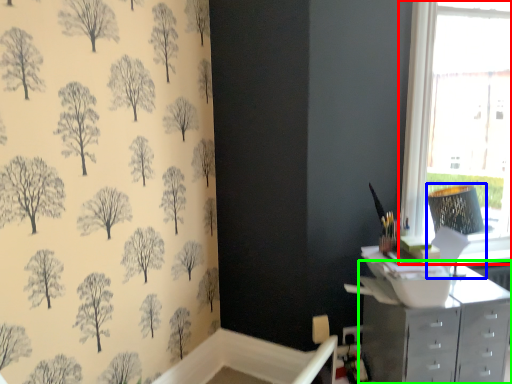
Question: Which object is the closest to the window (highlighted by a red box)? Choose among these: lamp (highlighted by a blue box) or chest of drawers (highlighted by a green box).

Choices:
 (A) lamp
 (B) chest of drawers

Answer: (A)